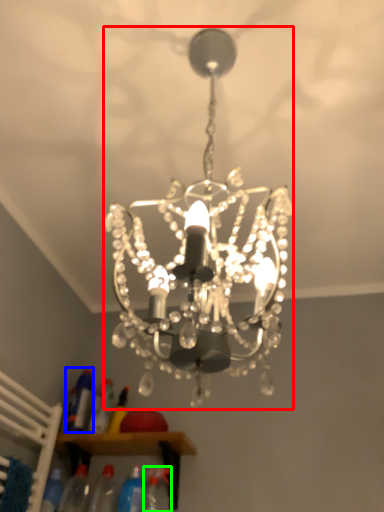
Question: Which object is positioned farthest from lamp (highlighted by a red box)? Select from bottle (highlighted by a blue box) and bottle (highlighted by a green box).

Choices:
 (A) bottle
 (B) bottle

Answer: (A)